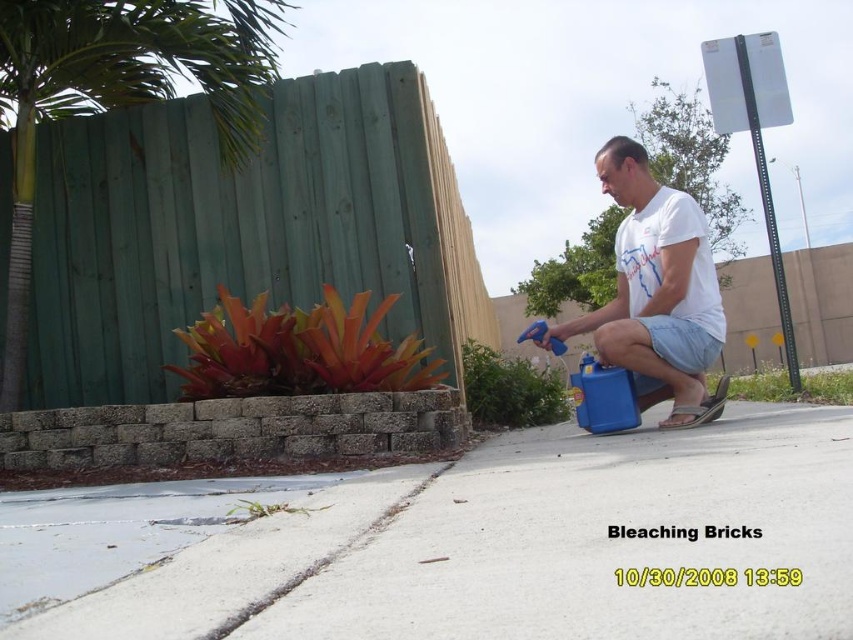
You are a delivery person trying to place a package on the white concrete pavement at center and the white matte shirt at center. Which surface can accommodate a larger item based on their sizes?

The white concrete pavement at center has a larger width than the white matte shirt at center, so it can accommodate a larger item.

You are a landscape architect designing a garden. You need to place a new statue that requires a base larger than the white concrete pavement at center. Can the green wood palm tree at upper left provide enough space for the statue base?

The white concrete pavement at center is smaller than the green wood palm tree at upper left, so the green wood palm tree at upper left may have sufficient space for the statue base since it is larger.

You are a delivery drone flying over the scene. You need to land precisely on the white concrete pavement at center. What are the coordinates where you should aim to land?

The white concrete pavement at center is located at coordinates point (526, 545), so you should aim for those coordinates to land precisely.